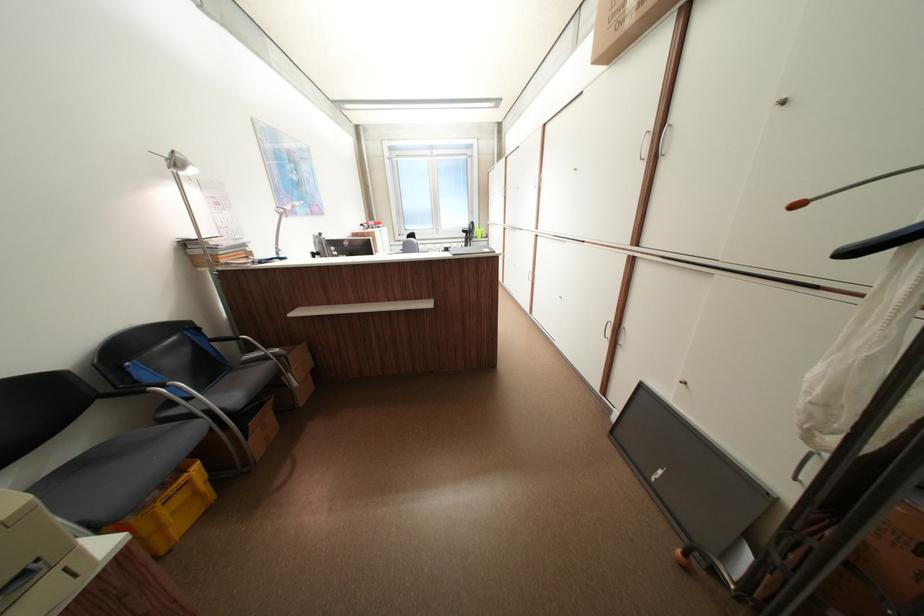
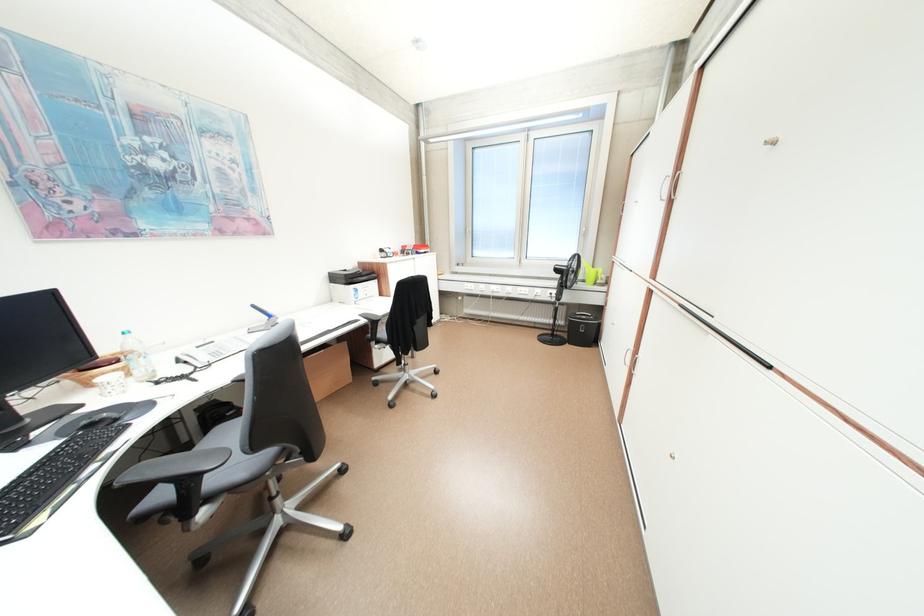
In the second image, find the point that corresponds to pixel 488 232 in the first image.

(598, 273)